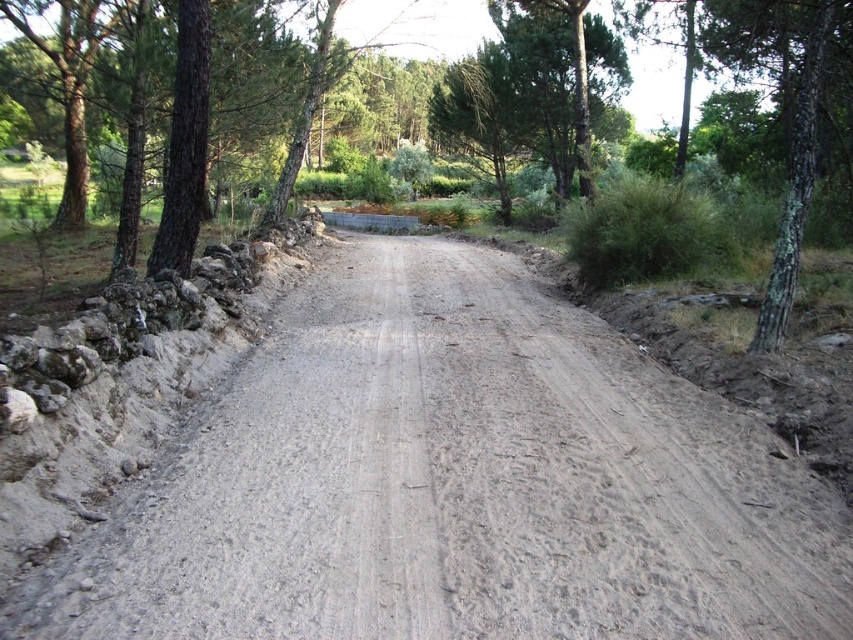
Question: Can you confirm if gray sandy dirt track at center is positioned to the right of green rough bark tree at right?

Choices:
 (A) yes
 (B) no

Answer: (B)

Question: Among these objects, which one is nearest to the camera?

Choices:
 (A) green rough bark tree at right
 (B) gray sandy dirt track at center

Answer: (B)

Question: Which point appears farthest from the camera in this image?

Choices:
 (A) (712, 520)
 (B) (811, 99)

Answer: (B)

Question: Where is gray sandy dirt track at center located in relation to green rough bark tree at right in the image?

Choices:
 (A) left
 (B) right

Answer: (A)

Question: Where is gray sandy dirt track at center located in relation to green rough bark tree at right in the image?

Choices:
 (A) left
 (B) right

Answer: (A)